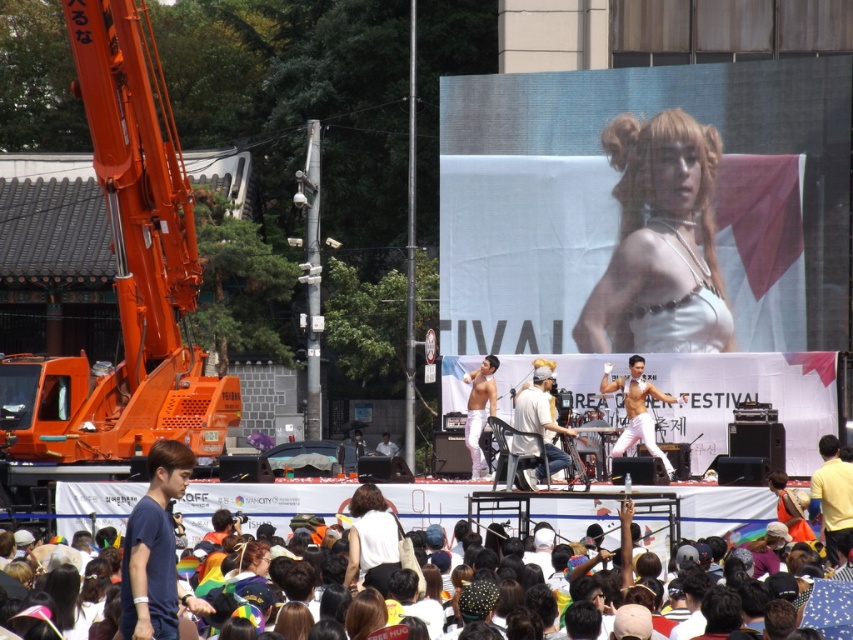
Can you confirm if white satin dress at upper center is positioned below shiny silver pants at stage center?

Actually, white satin dress at upper center is above shiny silver pants at stage center.

Which is behind, point (621, 152) or point (469, 396)?

Point (621, 152)

Locate an element on the screen. This screenshot has height=640, width=853. white satin dress at upper center is located at coordinates (659, 243).

Does white cotton shirt at center have a lesser width compared to shiny silver pants at center?

No.

Between white cotton shirt at center and shiny silver pants at center, which one has less height?

Standing shorter between the two is shiny silver pants at center.

Is point (532, 488) closer to camera compared to point (647, 449)?

That is True.

Where is `white cotton shirt at center`? The width and height of the screenshot is (853, 640). white cotton shirt at center is located at coordinates (541, 413).

Who is more distant from viewer, (814, 490) or (525, 412)?

The point (525, 412) is behind.

Between yellow cotton shirt at center and white cotton shirt at center, which one has less height?

yellow cotton shirt at center

Who is more distant from viewer, (x=825, y=508) or (x=515, y=396)?

The point (x=515, y=396) is behind.

You are a GUI agent. You are given a task and a screenshot of the screen. Output one action in this format:
    pyautogui.click(x=<x>, y=<y>)
    Task: Click on the yellow cotton shirt at center
    The height and width of the screenshot is (640, 853).
    Given the screenshot: What is the action you would take?
    pyautogui.click(x=831, y=496)